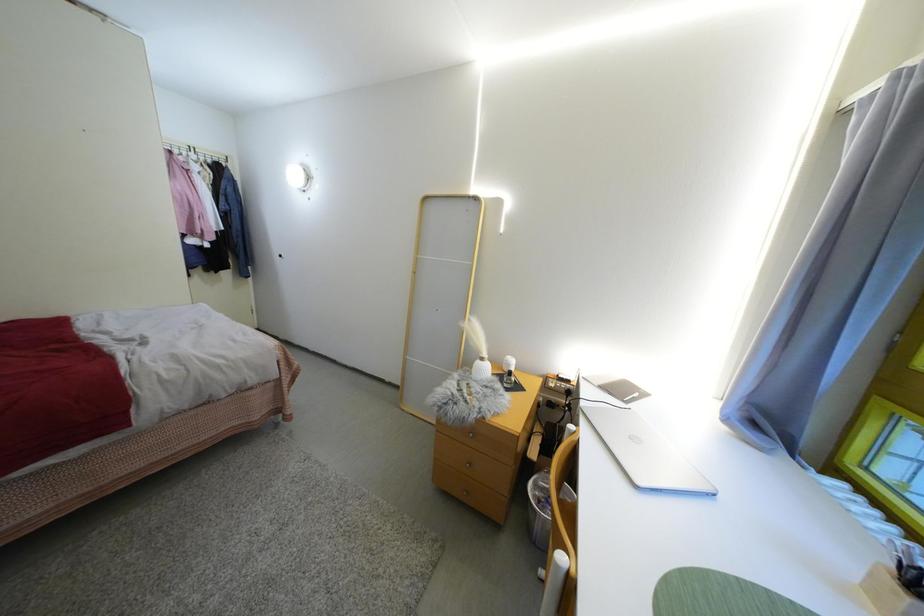
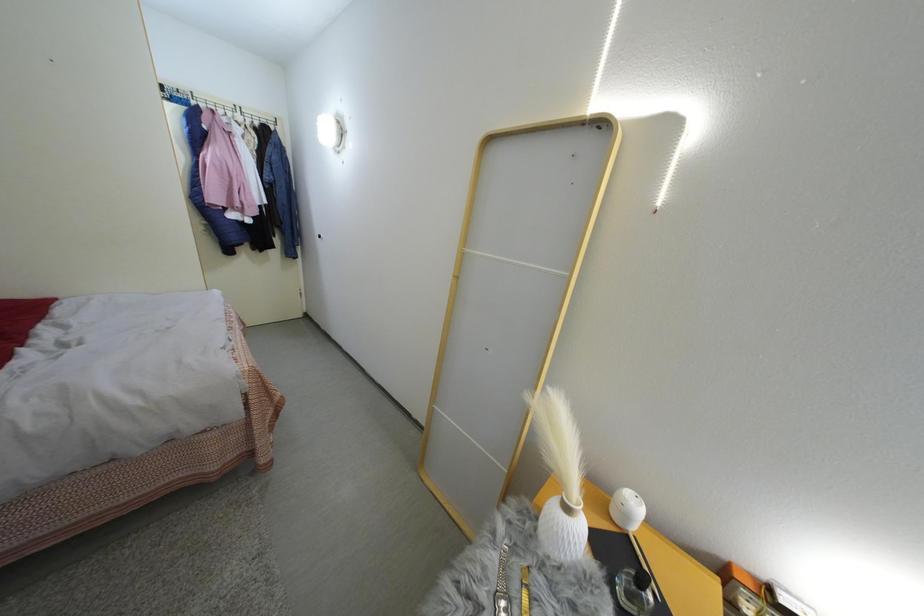
Question: Based on the continuous images, in which direction is the camera rotating? Reply with the corresponding letter.

Choices:
 (A) Left
 (B) Right
 (C) Up
 (D) Down

Answer: (A)